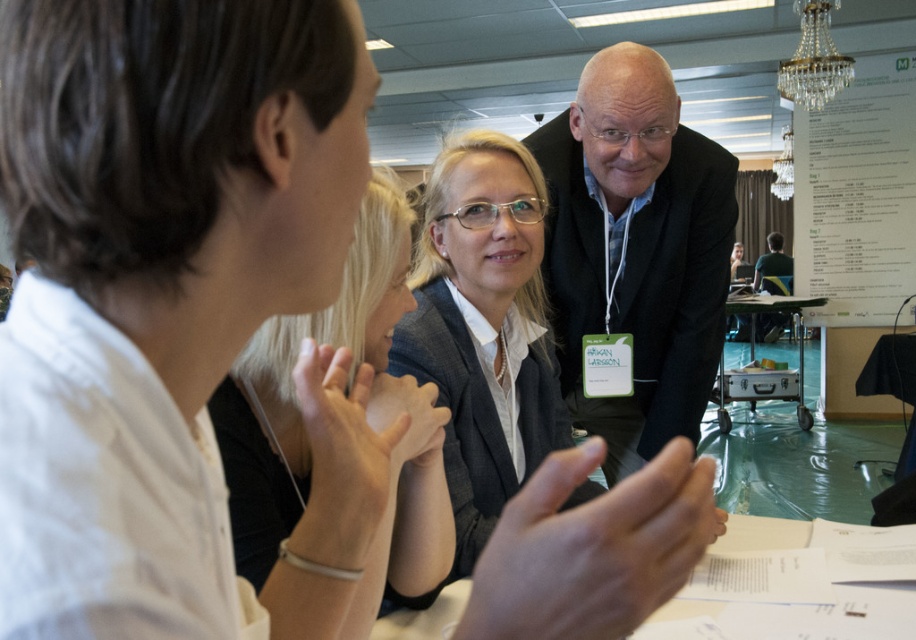
Question: Does dark gray suit at center have a larger size compared to green fabric shirt at center?

Choices:
 (A) yes
 (B) no

Answer: (B)

Question: Can you confirm if matte gray blazer at center is positioned to the right of white paper at upper right?

Choices:
 (A) no
 (B) yes

Answer: (A)

Question: Among these objects, which one is nearest to the camera?

Choices:
 (A) white paper at upper right
 (B) green fabric shirt at center

Answer: (A)

Question: Which of the following is the farthest from the observer?

Choices:
 (A) smooth black blazer at center
 (B) dark gray suit at center
 (C) matte gray blazer at center

Answer: (B)

Question: Which point is farther to the camera?

Choices:
 (A) (313, 324)
 (B) (802, 352)

Answer: (B)

Question: Is dark gray suit at center below matte gray blazer at center?

Choices:
 (A) no
 (B) yes

Answer: (A)